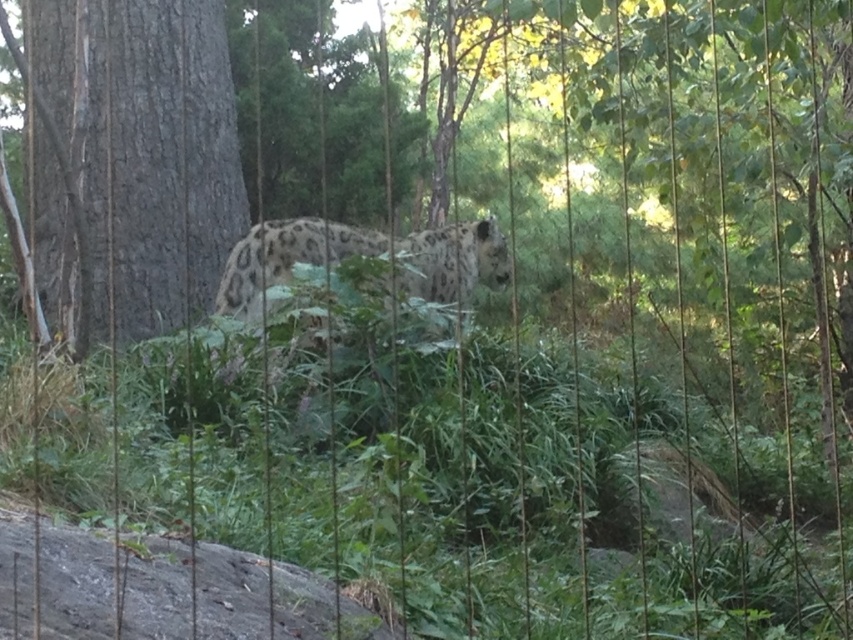
Question: Can you confirm if gray textured bark at left is wider than spotted fur leopard at center?

Choices:
 (A) no
 (B) yes

Answer: (A)

Question: In this image, where is gray textured bark at left located relative to spotted fur leopard at center?

Choices:
 (A) below
 (B) above

Answer: (B)

Question: Is gray textured bark at left below spotted fur leopard at center?

Choices:
 (A) no
 (B) yes

Answer: (A)

Question: Which point is farther to the camera?

Choices:
 (A) spotted fur leopard at center
 (B) gray textured bark at left

Answer: (B)

Question: Which object appears farthest from the camera in this image?

Choices:
 (A) spotted fur leopard at center
 (B) gray textured bark at left

Answer: (B)